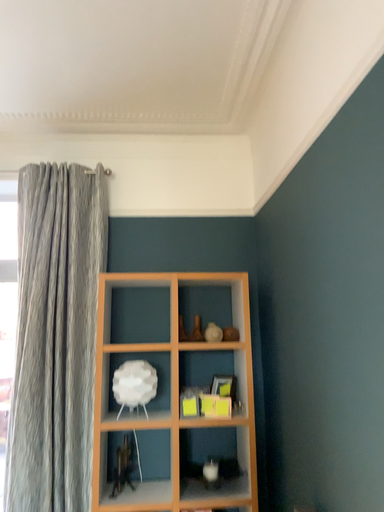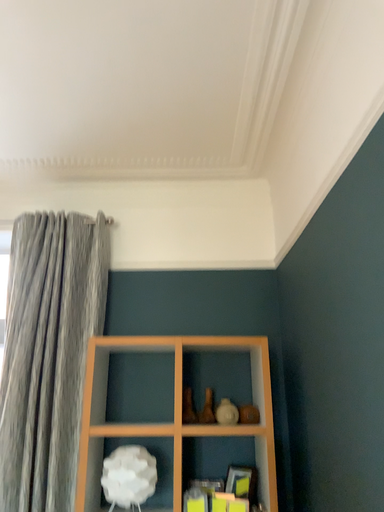
Question: Which way did the camera rotate in the video?

Choices:
 (A) rotated downward
 (B) rotated upward

Answer: (B)